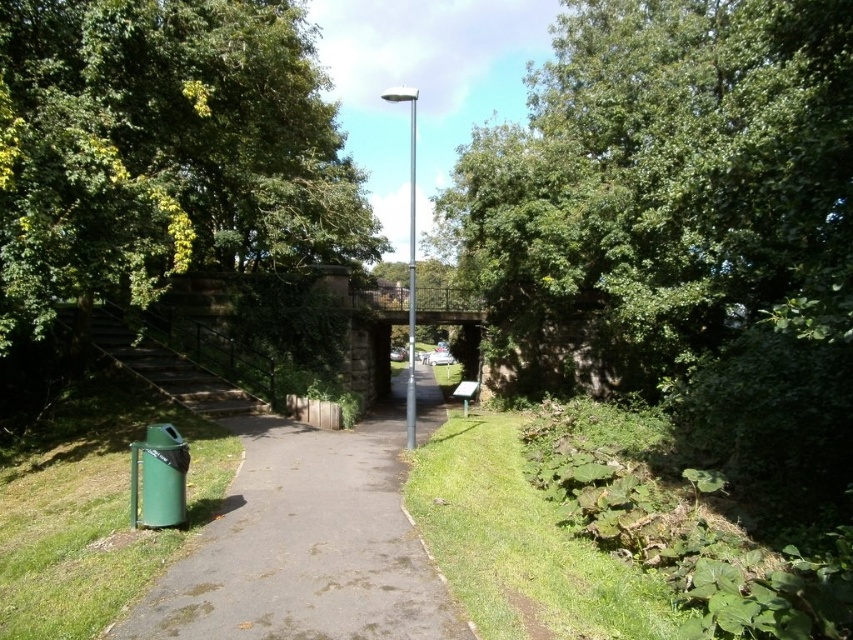
Is green leafy tree at upper center smaller than green leafy tree at upper left?

No.

Is point (833, 260) farther from camera compared to point (193, 195)?

No, (833, 260) is in front of (193, 195).

Locate an element on the screen. Image resolution: width=853 pixels, height=640 pixels. green leafy tree at upper center is located at coordinates (663, 189).

Who is more distant from viewer, [440,419] or [410,314]?

The point [440,419] is more distant.

Does green asphalt pavement at lower left have a smaller size compared to metallic pole at center?

Yes, green asphalt pavement at lower left is smaller than metallic pole at center.

Locate an element on the screen. The width and height of the screenshot is (853, 640). green asphalt pavement at lower left is located at coordinates (306, 545).

Where is `green asphalt pavement at lower left`? The width and height of the screenshot is (853, 640). green asphalt pavement at lower left is located at coordinates (306, 545).

Can you confirm if green leafy tree at upper center is taller than metallic pole at center?

Incorrect, green leafy tree at upper center's height is not larger of metallic pole at center's.

Is point (608, 372) farther from camera compared to point (415, 385)?

Yes.

You are a GUI agent. You are given a task and a screenshot of the screen. Output one action in this format:
    pyautogui.click(x=<x>, y=<y>)
    Task: Click on the green leafy tree at upper center
    The width and height of the screenshot is (853, 640).
    Given the screenshot: What is the action you would take?
    pyautogui.click(x=663, y=189)